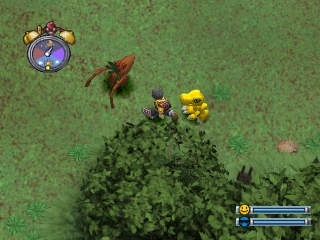
Find the location of a particular element. The image size is (320, 240). clock is located at coordinates (51, 54).